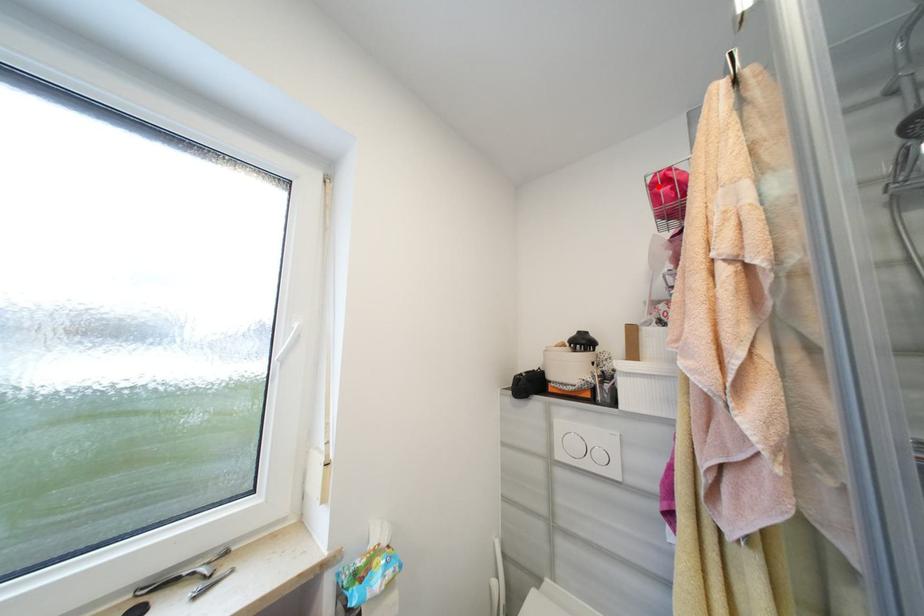
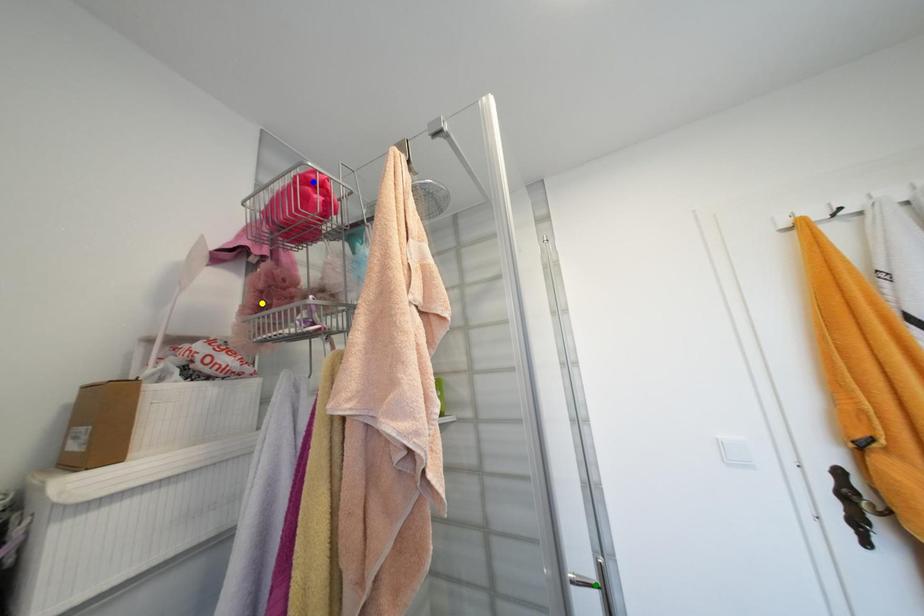
Question: I am providing you with two images of the same scene from different viewpoints. A red point is marked on the first image. You are given multiple points on the second image. Which mark in image 2 goes with the point in image 1?

Choices:
 (A) yellow point
 (B) green point
 (C) blue point

Answer: (C)